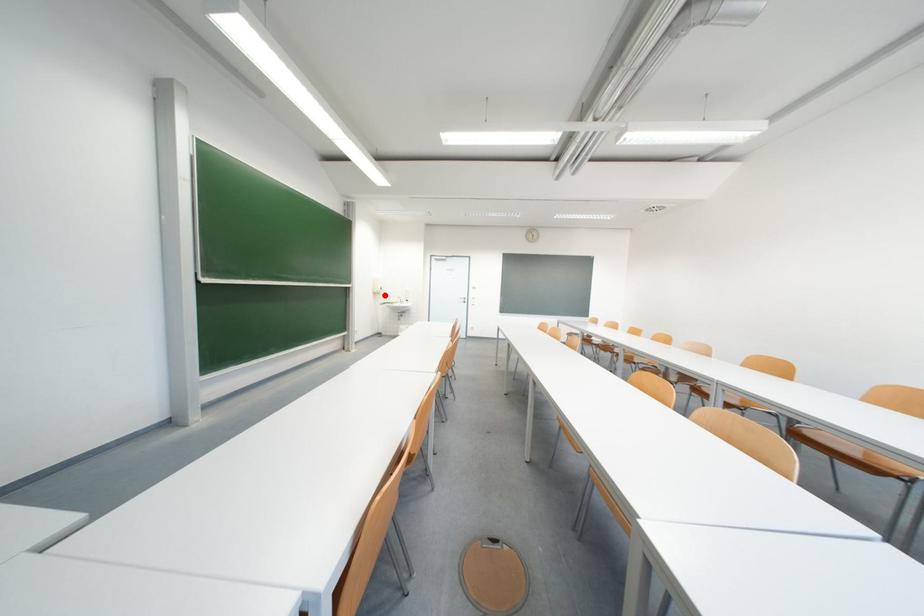
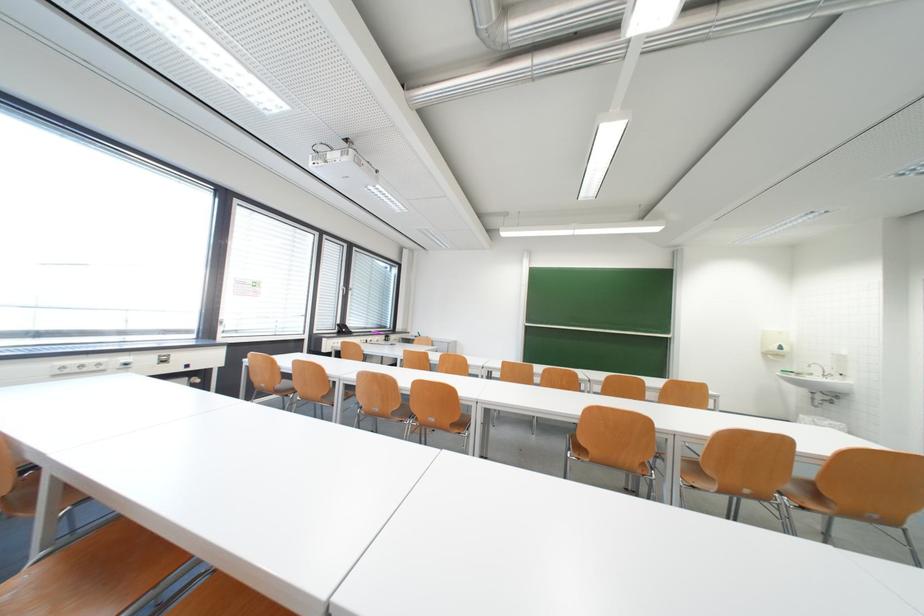
Question: I am providing you with two images of the same scene from different viewpoints. Image1 has a red point marked. In image2, the corresponding 3D location appears at what relative position? Reply with the corresponding letter.

Choices:
 (A) Closer
 (B) Farther

Answer: (B)